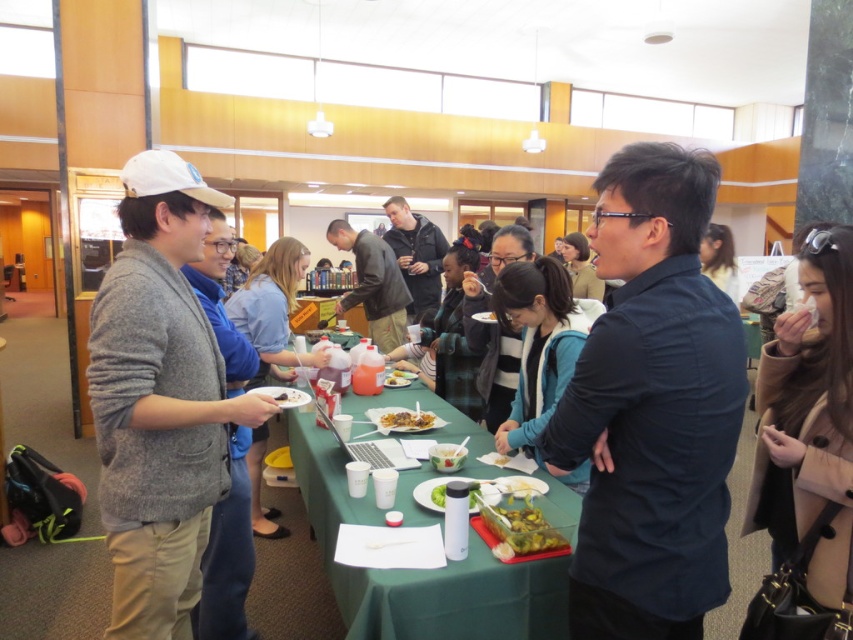
Can you confirm if blue fleece jacket at center is positioned above translucent plastic container at center?

Yes.

Where is `blue fleece jacket at center`? Image resolution: width=853 pixels, height=640 pixels. blue fleece jacket at center is located at coordinates (538, 342).

In the scene shown: Who is more forward, (509, 298) or (387, 387)?

Point (509, 298) is more forward.

The width and height of the screenshot is (853, 640). I want to click on blue fleece jacket at center, so click(x=538, y=342).

Between gray sweater at left and translucent plastic container at center, which one is positioned higher?

translucent plastic container at center is above.

Which is behind, point (200, 621) or point (383, 384)?

Point (383, 384)

Which is in front, point (216, 531) or point (405, 380)?

Point (216, 531)

Locate an element on the screen. gray sweater at left is located at coordinates (228, 552).

Is point (842, 266) positioned behind point (358, 589)?

No, (842, 266) is in front of (358, 589).

From the picture: Can you confirm if brown leather coat at center right is positioned to the left of green fabric table at center?

Incorrect, brown leather coat at center right is not on the left side of green fabric table at center.

At what (x,y) coordinates should I click in order to perform the action: click on brown leather coat at center right. Please return your answer as a coordinate pair (x, y). Looking at the image, I should click on (805, 452).

Identify the location of brown leather coat at center right. The width and height of the screenshot is (853, 640). tap(805, 452).